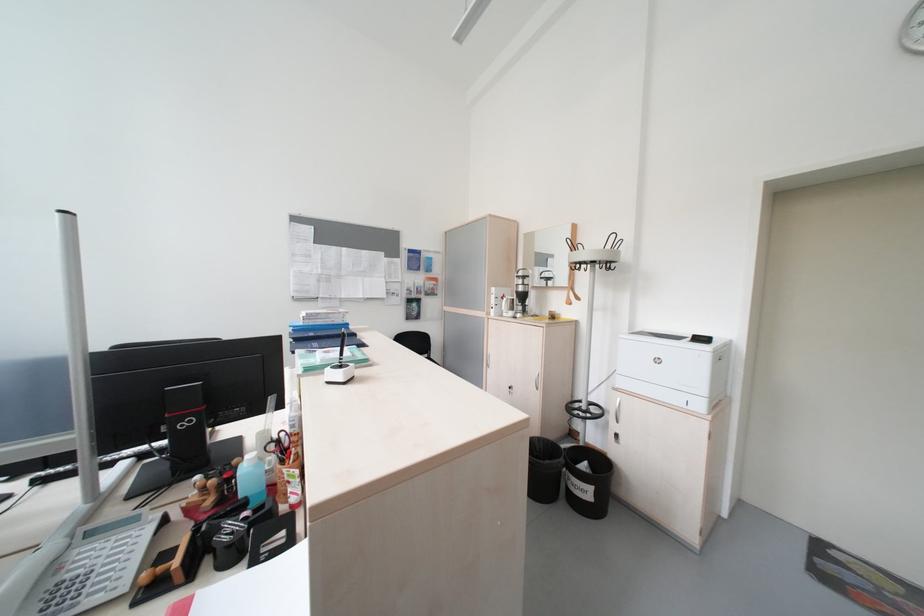
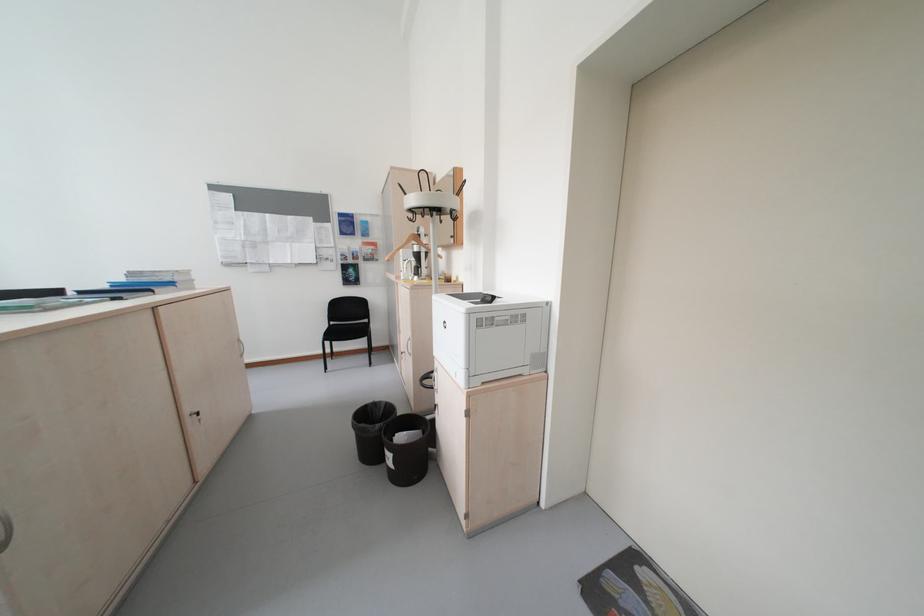
Find the pixel in the second image that matches pixel 330 323 in the first image.

(155, 281)